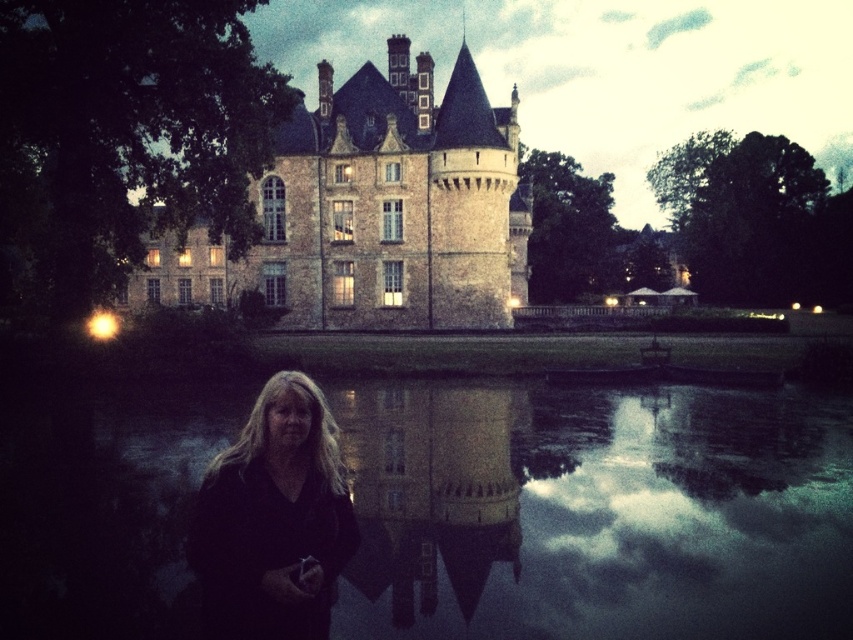
Question: Does smooth reflective water at center have a greater width compared to black matte hair at center?

Choices:
 (A) no
 (B) yes

Answer: (B)

Question: Among these objects, which one is nearest to the camera?

Choices:
 (A) smooth reflective water at center
 (B) smooth stone tower at center

Answer: (B)

Question: Does smooth reflective water at center appear over black matte hair at center?

Choices:
 (A) no
 (B) yes

Answer: (A)

Question: Which point is closer to the camera?

Choices:
 (A) brown stone castle at upper center
 (B) smooth reflective water at center

Answer: (B)

Question: Can you confirm if smooth reflective water at center is bigger than brown stone castle at upper center?

Choices:
 (A) no
 (B) yes

Answer: (A)

Question: Based on their relative distances, which object is farther from the brown stone castle at upper center?

Choices:
 (A) black matte hair at center
 (B) smooth reflective water at center
 (C) smooth stone tower at center

Answer: (A)